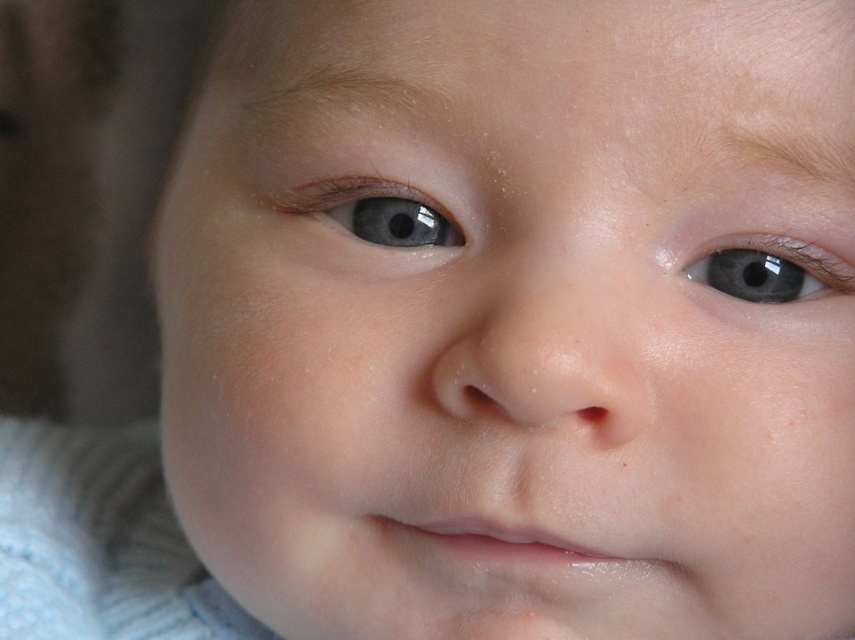
You are holding a small toy that is 2 inches wide. You want to place it so that it is exactly at the position of the point labeled point (317, 192). Considering the distance between you and the point, will the toy fit perfectly at that spot without overlapping any other objects?

The point labeled point (317, 192) is 13.58 inches away from you. Since the toy is only 2 inches wide, it can be placed at that position without overlapping other objects as the distance is sufficient.

Looking at the baby in the image, which blue glossy eye is taller between the blue glossy eye at center and the blue glossy eye at upper right?

The blue glossy eye at center is much taller than the blue glossy eye at upper right.